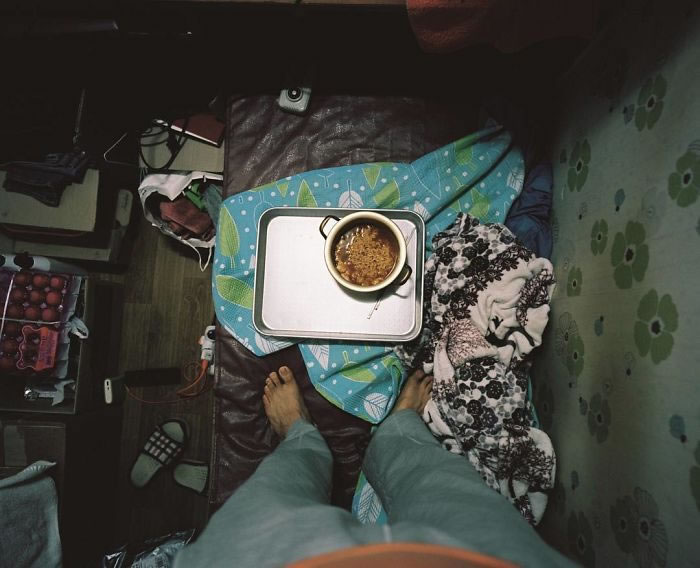
Locate an element on the screen. wallpaper is located at coordinates (626, 308).